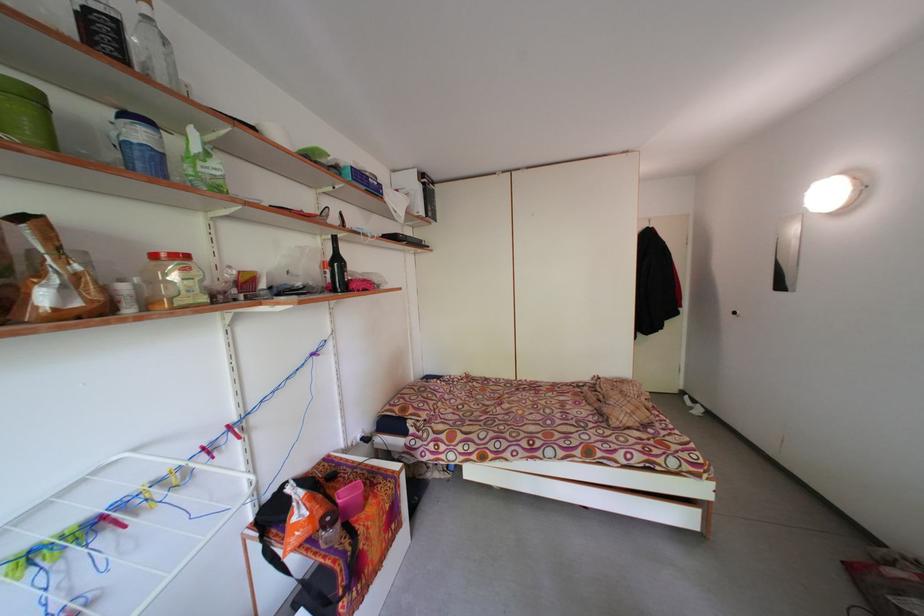
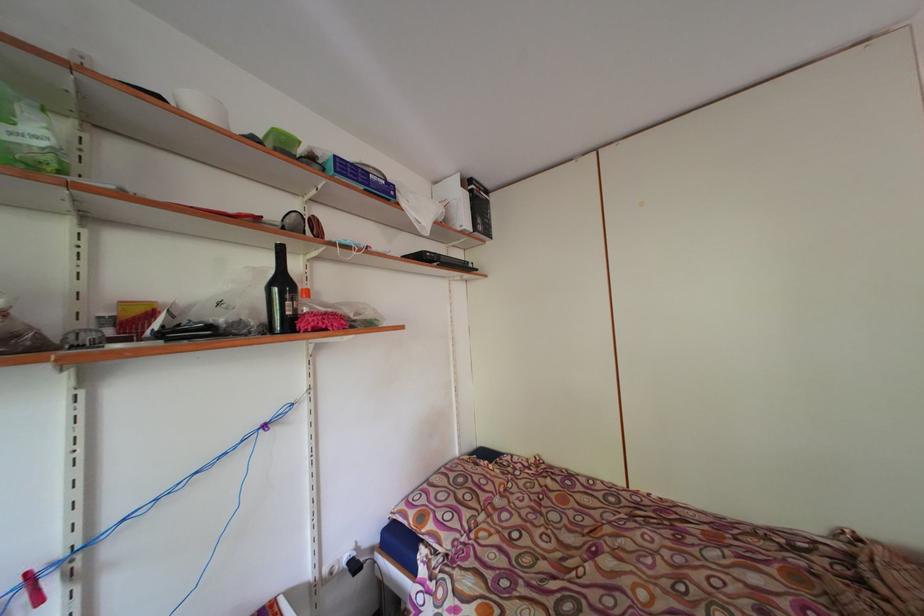
Where in the second image is the point corresponding to [256,284] from the first image?

(144, 317)